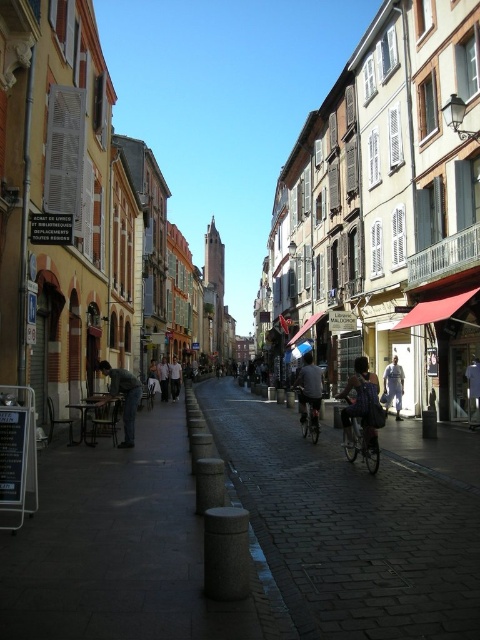
Question: Which object appears farthest from the camera in this image?

Choices:
 (A) light brown leather jacket at center
 (B) light beige shirt at center
 (C) denim jacket at center

Answer: (B)

Question: Considering the relative positions of metallic silver bicycle at center and silver metallic bicycle at center in the image provided, where is metallic silver bicycle at center located with respect to silver metallic bicycle at center?

Choices:
 (A) left
 (B) right

Answer: (B)

Question: Among these objects, which one is nearest to the camera?

Choices:
 (A) dark gray jeans at left
 (B) metallic silver bicycle at center

Answer: (B)

Question: Which object is closer to the camera taking this photo?

Choices:
 (A) silver metallic bicycle at center
 (B) dark gray jeans at left

Answer: (B)

Question: Is light blue denim jeans at center below white fabric shirt at center?

Choices:
 (A) yes
 (B) no

Answer: (A)

Question: Is the position of light beige shirt at center less distant than that of denim jacket at center?

Choices:
 (A) no
 (B) yes

Answer: (A)